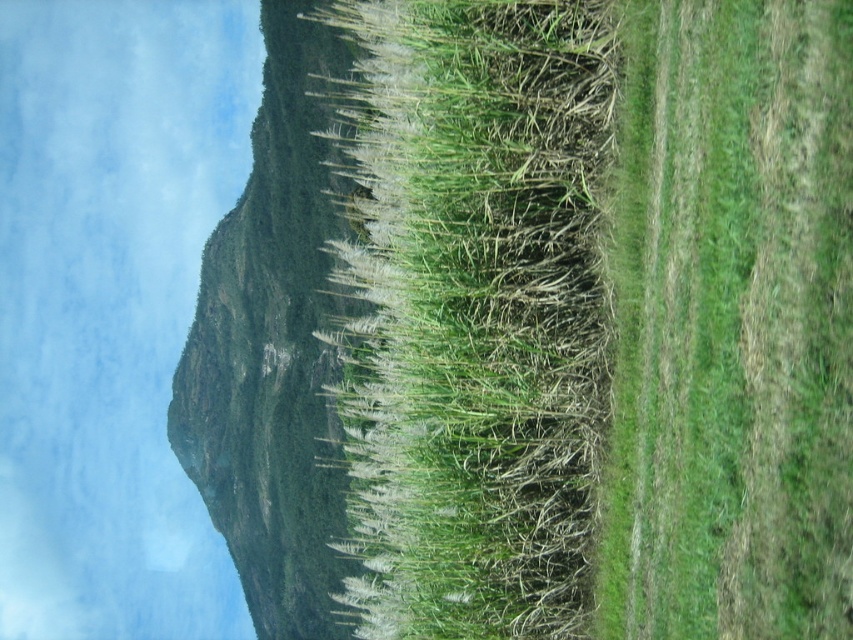
Question: Which point is farther from the camera taking this photo?

Choices:
 (A) (392, 422)
 (B) (685, 292)

Answer: (A)

Question: Which point is closer to the camera taking this photo?

Choices:
 (A) (567, 520)
 (B) (637, 614)

Answer: (B)

Question: Which point is closer to the camera?

Choices:
 (A) green grassy at center
 (B) green grassy at right

Answer: (B)

Question: Considering the relative positions of green grassy at center and green grassy at right in the image provided, where is green grassy at center located with respect to green grassy at right?

Choices:
 (A) left
 (B) right

Answer: (A)

Question: Is green grassy at center bigger than green grassy at right?

Choices:
 (A) yes
 (B) no

Answer: (A)

Question: Is green grassy at center above green grassy at right?

Choices:
 (A) no
 (B) yes

Answer: (A)